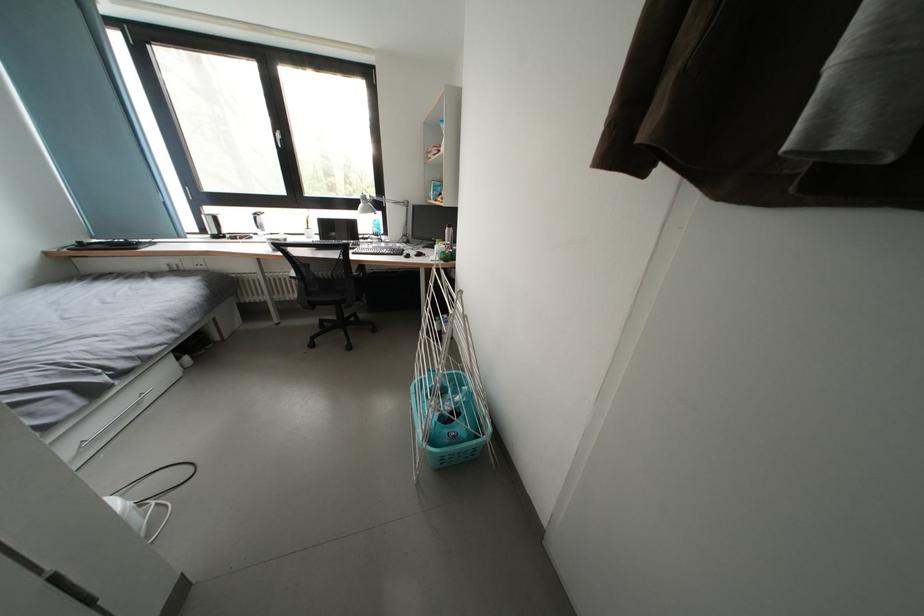
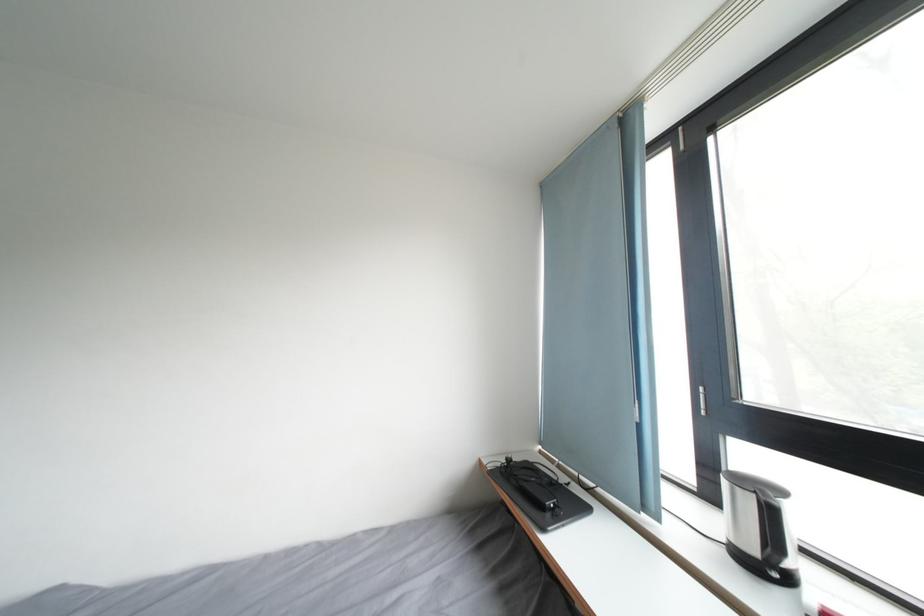
Find the pixel in the second image that matches the point at 187,241 in the first image.

(651, 514)